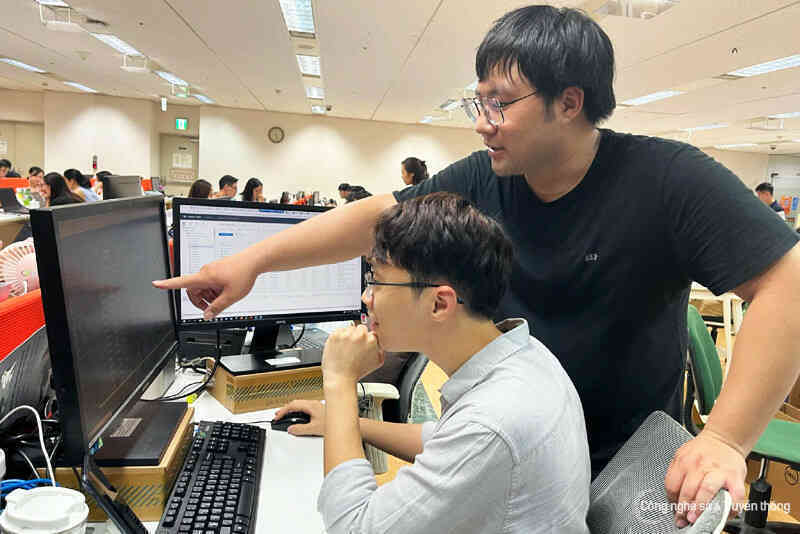
This screenshot has height=534, width=800. Identify the location of door. click(x=178, y=159).